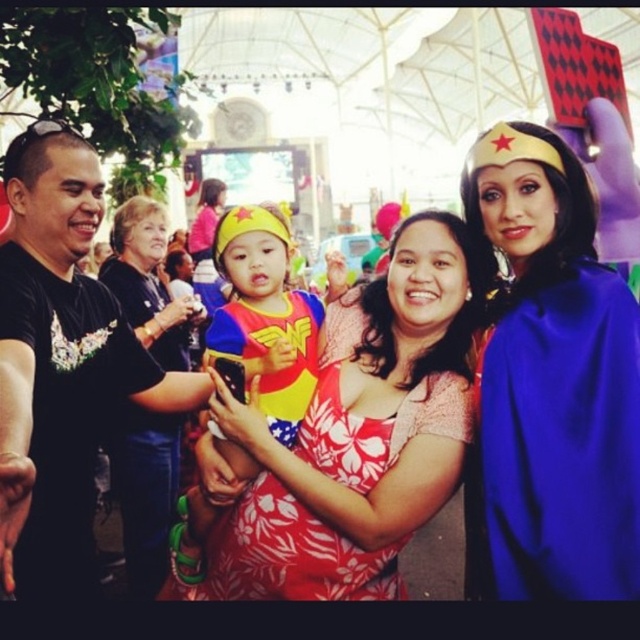
You are taking a photo at an event under a large white dome structure. In the foreground, there is a blue satin cape at center and a matte black shirt at left. Which object is covering part of the other?

The blue satin cape at center is positioned over the matte black shirt at left, so it is covering part of it.

You are standing at point (22, 272) and want to take a photo of the stage. There is another person at point (387, 276). Will they block your view?

Yes, the person at point (387, 276) will block your view because they are behind your position at point (22, 272).